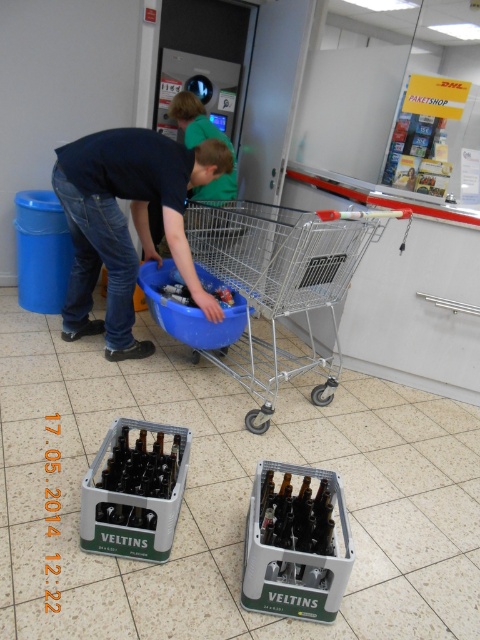
Can you confirm if silver metallic shopping cart at center is thinner than dark blue jeans at lower left?

No, silver metallic shopping cart at center is not thinner than dark blue jeans at lower left.

Can you confirm if silver metallic shopping cart at center is taller than dark blue jeans at lower left?

Indeed, silver metallic shopping cart at center has a greater height compared to dark blue jeans at lower left.

What do you see at coordinates (280, 284) in the screenshot?
I see `silver metallic shopping cart at center` at bounding box center [280, 284].

Where is `silver metallic shopping cart at center`? The height and width of the screenshot is (640, 480). silver metallic shopping cart at center is located at coordinates (280, 284).